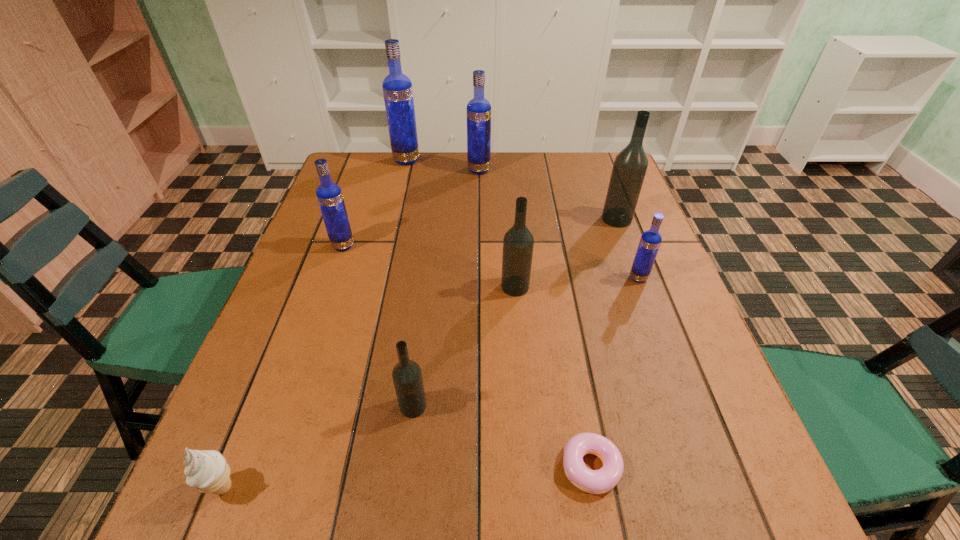
The image size is (960, 540). What are the coordinates of `vacant area that lies between the shortest object and the icecream` in the screenshot? It's located at (407, 477).

In order to click on free space between the third vodka from right to left and the third farthest object in this screenshot , I will do `click(566, 253)`.

You are a GUI agent. You are given a task and a screenshot of the screen. Output one action in this format:
    pyautogui.click(x=<x>, y=<y>)
    Task: Click on the free spot between the rightmost blue vodka and the shortest object
    This screenshot has height=540, width=960.
    Given the screenshot: What is the action you would take?
    pyautogui.click(x=614, y=373)

This screenshot has width=960, height=540. Find the location of `free space between the third biggest blue vodka and the leftmost object`. free space between the third biggest blue vodka and the leftmost object is located at coordinates (283, 366).

Where is `free area in between the second smallest blue vodka and the doughnut`? The height and width of the screenshot is (540, 960). free area in between the second smallest blue vodka and the doughnut is located at coordinates (467, 356).

You are a GUI agent. You are given a task and a screenshot of the screen. Output one action in this format:
    pyautogui.click(x=<x>, y=<y>)
    Task: Click on the empty location between the third object from left to right and the third smallest blue vodka
    This screenshot has height=540, width=960.
    Given the screenshot: What is the action you would take?
    pyautogui.click(x=443, y=165)

Identify which object is the sixth nearest to the second object from left to right. Please provide its 2D coordinates. Your answer should be formatted as a tuple, i.e. [(x, y)], where the tuple contains the x and y coordinates of a point satisfying the conditions above.

[(630, 165)]

Locate which object is the second closest to the fifth object from right to left. Please provide its 2D coordinates. Your answer should be formatted as a tuple, i.e. [(x, y)], where the tuple contains the x and y coordinates of a point satisfying the conditions above.

[(630, 165)]

Find the location of a particular element. vodka that can be found as the sixth closest to the fourth vodka from left to right is located at coordinates (407, 377).

Point out which vodka is positioned as the fifth nearest to the smallest blue vodka. Please provide its 2D coordinates. Your answer should be formatted as a tuple, i.e. [(x, y)], where the tuple contains the x and y coordinates of a point satisfying the conditions above.

[(329, 195)]